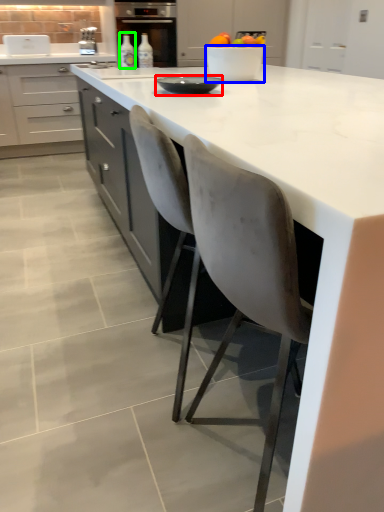
Question: Estimate the real-world distances between objects in this image. Which object is closer to tableware (highlighted by a red box), bowl (highlighted by a blue box) or bottle (highlighted by a green box)?

Choices:
 (A) bowl
 (B) bottle

Answer: (A)